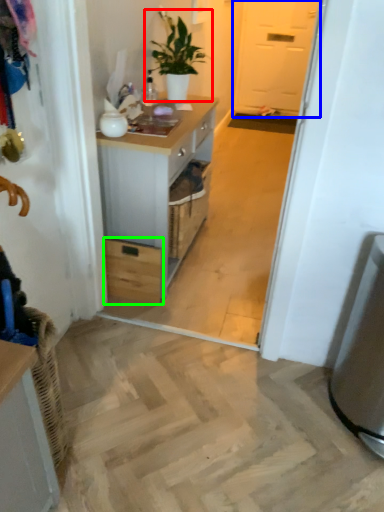
Question: Estimate the real-world distances between objects in this image. Which object is farther from houseplant (highlighted by a red box), screen door (highlighted by a blue box) or drawer (highlighted by a green box)?

Choices:
 (A) screen door
 (B) drawer

Answer: (A)